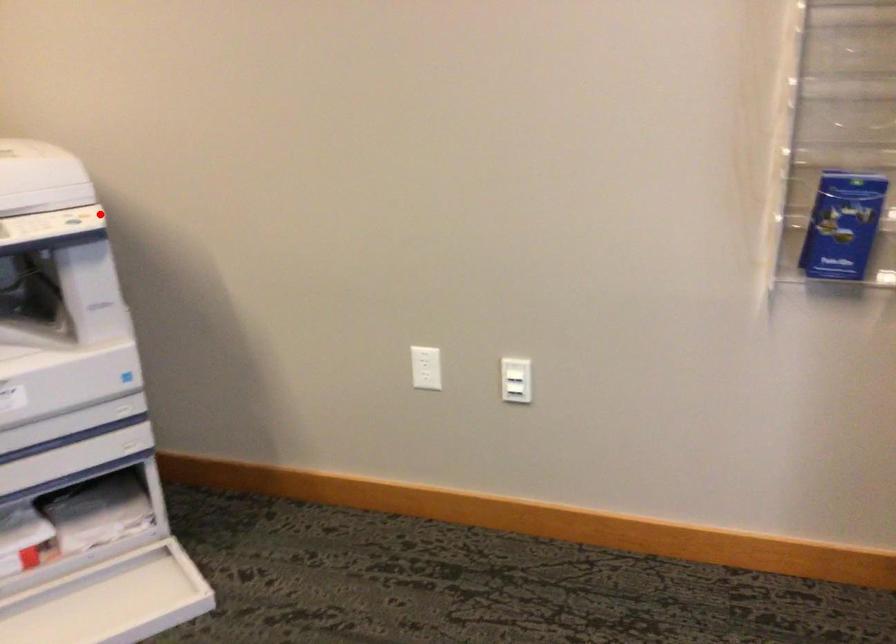
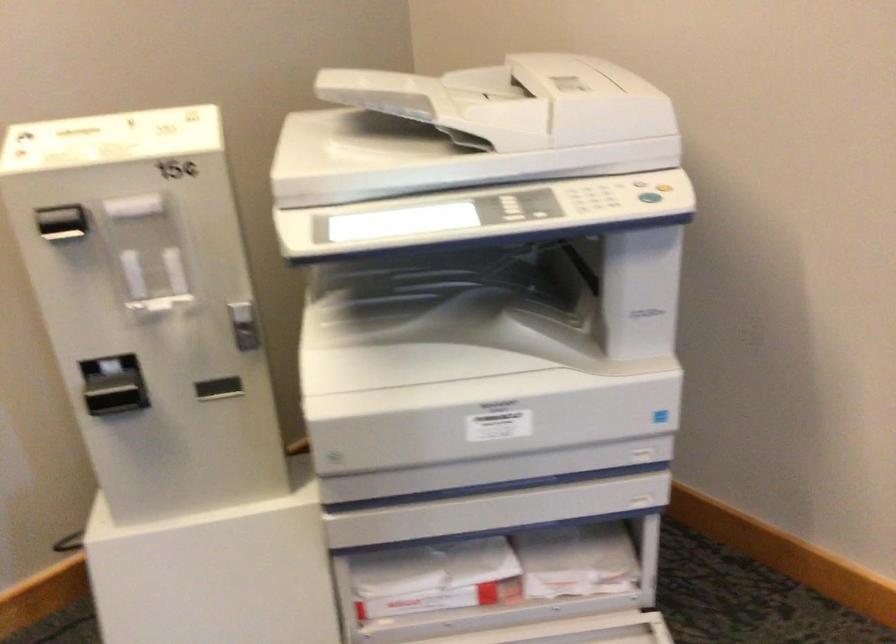
Question: I am providing you with two images of the same scene from different viewpoints. Given a red point in image1, look at the same physical point in image2. Is it:

Choices:
 (A) Closer to the viewpoint
 (B) Farther from the viewpoint

Answer: (A)